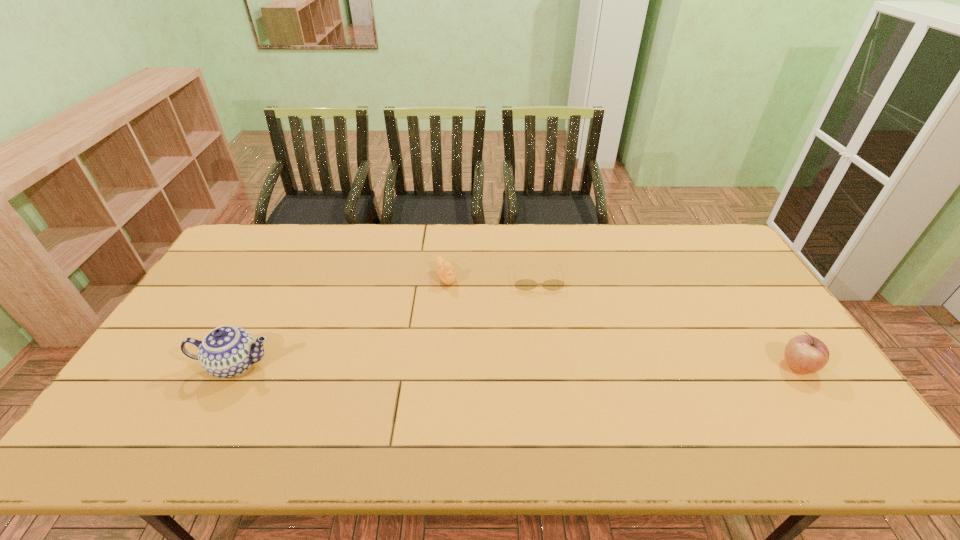
This screenshot has width=960, height=540. Identify the location of free space on the desktop that is between the tallest object and the apple and is positioned on the face of the duckling. (499, 365).

Image resolution: width=960 pixels, height=540 pixels. In order to click on vacant spot on the desktop that is between the leftmost object and the apple and is positioned on the face of the second object from right to left in this screenshot , I will do tap(549, 366).